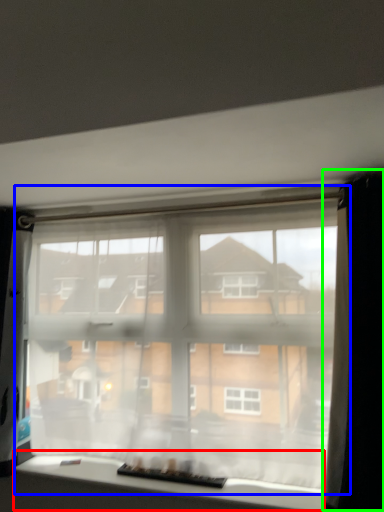
Question: Which object is the farthest from window (highlighted by a red box)? Choose among these: window (highlighted by a blue box) or curtain (highlighted by a green box).

Choices:
 (A) window
 (B) curtain

Answer: (B)